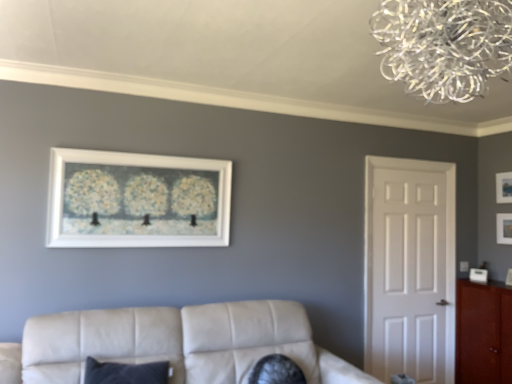
What do you see at coordinates (410, 268) in the screenshot?
I see `white matte door at right` at bounding box center [410, 268].

The width and height of the screenshot is (512, 384). What do you see at coordinates (444, 46) in the screenshot?
I see `clear glass chandelier at upper right` at bounding box center [444, 46].

Describe the element at coordinates (504, 228) in the screenshot. I see `matte white picture frame at upper right, the second picture frame viewed from the left` at that location.

At what (x,y) coordinates should I click in order to perform the action: click on matte black picture frame at upper right, which ranks as the third picture frame in left-to-right order. Please return your answer as a coordinate pair (x, y). The height and width of the screenshot is (384, 512). Looking at the image, I should click on (503, 187).

Where is `white matte door at right`? white matte door at right is located at coordinates pos(410,268).

Where is `lamp that appears on the right of leather couch at lower center`? The image size is (512, 384). lamp that appears on the right of leather couch at lower center is located at coordinates (444, 46).

Is leather couch at lower center in front of or behind clear glass chandelier at upper right in the image?

In the image, leather couch at lower center appears behind clear glass chandelier at upper right.

Is leather couch at lower center facing towards clear glass chandelier at upper right?

No, leather couch at lower center is not oriented towards clear glass chandelier at upper right.

Considering the sizes of leather couch at lower center and clear glass chandelier at upper right in the image, is leather couch at lower center taller or shorter than clear glass chandelier at upper right?

Considering their sizes, leather couch at lower center has more height than clear glass chandelier at upper right.

Is leather couch at lower center placed right next to mahogany wood cabinet at right?

No, leather couch at lower center is not in contact with mahogany wood cabinet at right.

Based on the photo, is leather couch at lower center oriented towards mahogany wood cabinet at right?

No, leather couch at lower center is not facing towards mahogany wood cabinet at right.

Considering the relative sizes of leather couch at lower center and mahogany wood cabinet at right in the image provided, is leather couch at lower center smaller than mahogany wood cabinet at right?

No.

Does point (342, 381) come behind point (492, 332)?

No, it is not.

What's the angular difference between white matte door at right and clear glass chandelier at upper right's facing directions?

89.5 degrees.

Between white matte door at right and clear glass chandelier at upper right, which one is positioned behind?

white matte door at right is behind.

From a real-world perspective, is white matte door at right beneath clear glass chandelier at upper right?

Yes, from a real-world perspective, white matte door at right is under clear glass chandelier at upper right.

Does white matte door at right have a larger size compared to clear glass chandelier at upper right?

No.

Is leather couch at lower center taller than white matte picture frame at upper center, which is counted as the 1th picture frame, starting from the front?

Yes.

Does leather couch at lower center turn towards white matte picture frame at upper center, arranged as the third picture frame when viewed from the right?

No, leather couch at lower center does not turn towards white matte picture frame at upper center, arranged as the third picture frame when viewed from the right.

Considering the sizes of objects leather couch at lower center and white matte picture frame at upper center, marked as the third picture frame in a back-to-front arrangement, in the image provided, who is wider, leather couch at lower center or white matte picture frame at upper center, marked as the third picture frame in a back-to-front arrangement,?

leather couch at lower center.

Which of these two, white matte door at right or matte black picture frame at upper right, the 3th picture frame positioned from the front, stands taller?

white matte door at right.

Considering the positions of objects white matte door at right and matte black picture frame at upper right, arranged as the first picture frame when viewed from the back, in the image provided, who is behind, white matte door at right or matte black picture frame at upper right, arranged as the first picture frame when viewed from the back,?

matte black picture frame at upper right, arranged as the first picture frame when viewed from the back, is behind.

Are white matte door at right and matte black picture frame at upper right, the 3th picture frame positioned from the front, located far from each other?

Yes, white matte door at right is far from matte black picture frame at upper right, the 3th picture frame positioned from the front.

In the scene shown: Does white matte door at right appear on the left side of matte black picture frame at upper right, arranged as the first picture frame when viewed from the back?

Indeed, white matte door at right is positioned on the left side of matte black picture frame at upper right, arranged as the first picture frame when viewed from the back.

From the image's perspective, is white matte picture frame at upper center, arranged as the third picture frame when viewed from the right, located above white matte door at right?

Yes, from the image's perspective, white matte picture frame at upper center, arranged as the third picture frame when viewed from the right, is over white matte door at right.

Does point (65, 224) lie behind point (399, 205)?

That is False.

Considering the sizes of white matte picture frame at upper center, marked as the third picture frame in a back-to-front arrangement, and white matte door at right in the image, is white matte picture frame at upper center, marked as the third picture frame in a back-to-front arrangement, bigger or smaller than white matte door at right?

white matte picture frame at upper center, marked as the third picture frame in a back-to-front arrangement, is bigger than white matte door at right.

From a real-world perspective, starting from the white matte door at right, which picture frame is the 2nd one vertically above it? Please provide its 2D coordinates.

[(137, 200)]

Is mahogany wood cabinet at right taller than leather couch at lower center?

Indeed, mahogany wood cabinet at right has a greater height compared to leather couch at lower center.

From a real-world perspective, is mahogany wood cabinet at right above or below leather couch at lower center?

In terms of real-world spatial position, mahogany wood cabinet at right is below leather couch at lower center.

From the image's perspective, between mahogany wood cabinet at right and leather couch at lower center, who is located below?

From the image's view, mahogany wood cabinet at right is below.

Measure the distance from mahogany wood cabinet at right to leather couch at lower center.

The distance of mahogany wood cabinet at right from leather couch at lower center is 5.66 feet.

I want to click on lamp in front of the leather couch at lower center, so click(444, 46).

Locate an element on the screen. Image resolution: width=512 pixels, height=384 pixels. studio couch above the mahogany wood cabinet at right (from a real-world perspective) is located at coordinates (181, 342).

Considering their positions, is mahogany wood cabinet at right positioned closer to matte black picture frame at upper right, the 3th picture frame positioned from the front, than clear glass chandelier at upper right?

The object closer to matte black picture frame at upper right, the 3th picture frame positioned from the front, is mahogany wood cabinet at right.

Based on their spatial positions, is clear glass chandelier at upper right or white matte picture frame at upper center, marked as the third picture frame in a back-to-front arrangement, closer to white matte door at right?

Based on the image, white matte picture frame at upper center, marked as the third picture frame in a back-to-front arrangement, appears to be nearer to white matte door at right.

Based on their spatial positions, is matte black picture frame at upper right, the 3th picture frame positioned from the front, or white matte picture frame at upper center, marked as the third picture frame in a back-to-front arrangement, further from white matte door at right?

white matte picture frame at upper center, marked as the third picture frame in a back-to-front arrangement.

Looking at the image, which one is located closer to white matte picture frame at upper center, the 1th picture frame from the left, white matte door at right or matte black picture frame at upper right, the 1th picture frame viewed from the right?

white matte door at right is closer to white matte picture frame at upper center, the 1th picture frame from the left.

Estimate the real-world distances between objects in this image. Which object is closer to white matte picture frame at upper center, which is counted as the 1th picture frame, starting from the front, white matte door at right or leather couch at lower center?

leather couch at lower center.

Looking at the image, which one is located further to matte white picture frame at upper right, which appears as the second picture frame when viewed from the front, white matte picture frame at upper center, which is counted as the 1th picture frame, starting from the front, or clear glass chandelier at upper right?

The object further to matte white picture frame at upper right, which appears as the second picture frame when viewed from the front, is clear glass chandelier at upper right.

Considering their positions, is white matte picture frame at upper center, the 1th picture frame from the left, positioned closer to mahogany wood cabinet at right than matte black picture frame at upper right, which ranks as the third picture frame in left-to-right order?

Among the two, matte black picture frame at upper right, which ranks as the third picture frame in left-to-right order, is located nearer to mahogany wood cabinet at right.

When comparing their distances from white matte picture frame at upper center, the 1th picture frame from the left, does matte white picture frame at upper right, the 2th picture frame from the right, or mahogany wood cabinet at right seem further?

matte white picture frame at upper right, the 2th picture frame from the right, is positioned further to the anchor white matte picture frame at upper center, the 1th picture frame from the left.

The width and height of the screenshot is (512, 384). I want to click on door between white matte picture frame at upper center, arranged as the third picture frame when viewed from the right, and matte black picture frame at upper right, arranged as the first picture frame when viewed from the back, in the horizontal direction, so click(410, 268).

You are a GUI agent. You are given a task and a screenshot of the screen. Output one action in this format:
    pyautogui.click(x=<x>, y=<y>)
    Task: Click on the lamp between white matte picture frame at upper center, which is counted as the 1th picture frame, starting from the front, and mahogany wood cabinet at right
    
    Given the screenshot: What is the action you would take?
    pyautogui.click(x=444, y=46)

Identify the location of picture frame between leather couch at lower center and matte black picture frame at upper right, the 1th picture frame viewed from the right, in the horizontal direction. The height and width of the screenshot is (384, 512). (504, 228).

Find the location of a particular element. Image resolution: width=512 pixels, height=384 pixels. cabinetry situated between leather couch at lower center and matte black picture frame at upper right, the 3th picture frame positioned from the front, from left to right is located at coordinates (483, 333).